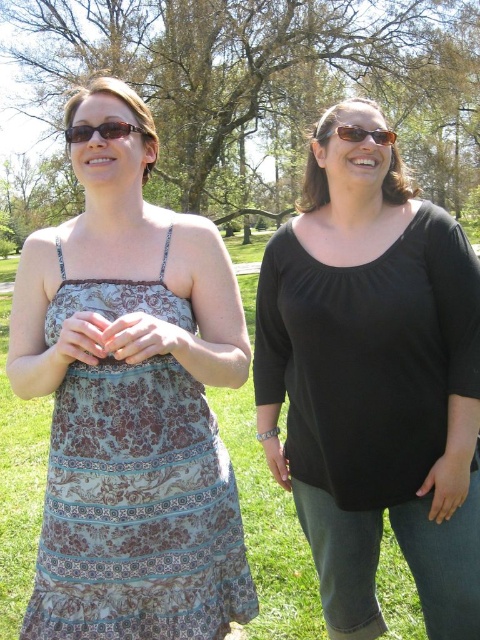
Looking at this image, you are a photographer trying to capture both the black matte top at center and the printed fabric dress at center in a single frame. Given that the camera can only focus on one object at a time, which object should you focus on to ensure the other remains in the background?

The black matte top at center is bigger than the printed fabric dress at center, so you should focus on the black matte top at center to ensure the printed fabric dress at center stays in the background.

You are a photographer trying to capture a clear shot of the black matte top at center and the matte black sunglasses at upper left. Since you want both objects to be in focus, which one should you adjust your camera focus on first?

The black matte top at center is further to the viewer than the matte black sunglasses at upper left, so you should focus on the black matte top at center first to ensure both are in focus.

You are a photographer setting up a shoot in the park. You notice the printed fabric dress at center and the matte black sunglasses at upper left in your frame. Based on their positions, which object would you adjust to ensure both are equally visible in the photo?

The printed fabric dress at center is below the matte black sunglasses at upper left. To make both equally visible, you should lower the matte black sunglasses at upper left or raise the printed fabric dress at center so they are at the same vertical level.